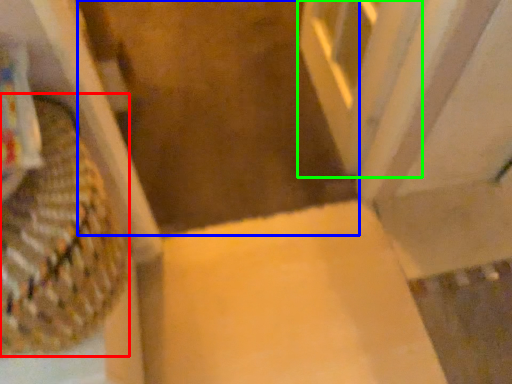
Question: Which object is the closest to the basket (highlighted by a red box)? Choose among these: aisle (highlighted by a blue box) or screen door (highlighted by a green box).

Choices:
 (A) aisle
 (B) screen door

Answer: (B)